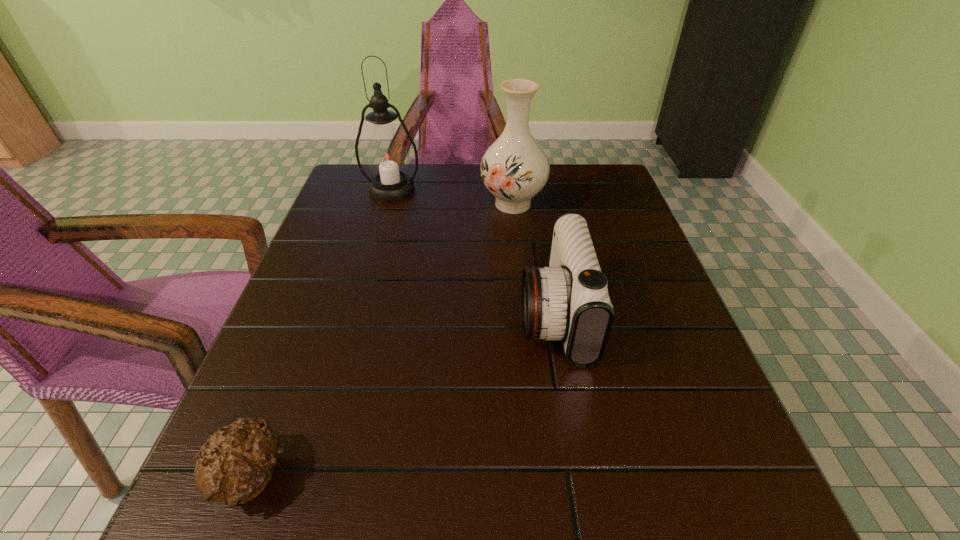
Identify the location of vacant area situated 0.230m on the surface of the third tallest object. [x=401, y=315].

This screenshot has width=960, height=540. Identify the location of free space located on the back of the shortest object. (286, 382).

You are a GUI agent. You are given a task and a screenshot of the screen. Output one action in this format:
    pyautogui.click(x=<x>, y=<y>)
    Task: Click on the oil lamp located in the far edge section of the desktop
    Image resolution: width=960 pixels, height=540 pixels.
    Given the screenshot: What is the action you would take?
    pyautogui.click(x=386, y=155)

The image size is (960, 540). Identify the location of vase present at the far edge. (515, 168).

Where is `object that is at the near edge`? The width and height of the screenshot is (960, 540). object that is at the near edge is located at coordinates (233, 466).

Identify the location of oil lamp present at the left edge. The image size is (960, 540). (386, 155).

I want to click on muffin that is at the left edge, so click(233, 466).

The image size is (960, 540). What are the coordinates of `object at the far left corner` in the screenshot? It's located at click(386, 155).

The width and height of the screenshot is (960, 540). What are the coordinates of `object at the near left corner` in the screenshot? It's located at click(233, 466).

Find the location of a particular element. This screenshot has height=540, width=960. free space at the far edge of the desktop is located at coordinates (455, 198).